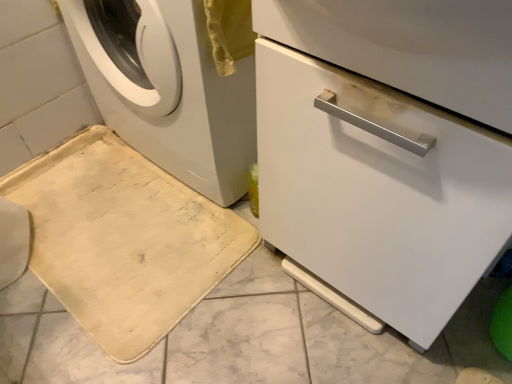
Question: From a real-world perspective, is white matte washing machine at left on beige fabric bath mat at lower left?

Choices:
 (A) yes
 (B) no

Answer: (A)

Question: Does white matte washing machine at left lie in front of beige fabric bath mat at lower left?

Choices:
 (A) yes
 (B) no

Answer: (A)

Question: Would you say white matte washing machine at left is outside beige fabric bath mat at lower left?

Choices:
 (A) yes
 (B) no

Answer: (A)

Question: Does white matte washing machine at left have a greater width compared to beige fabric bath mat at lower left?

Choices:
 (A) no
 (B) yes

Answer: (A)

Question: Is white matte washing machine at left not close to beige fabric bath mat at lower left?

Choices:
 (A) yes
 (B) no

Answer: (B)

Question: Relative to beige fabric bath mat at lower left, is white matte washing machine at left in front or behind?

Choices:
 (A) behind
 (B) front

Answer: (B)

Question: From their relative heights in the image, would you say white matte washing machine at left is taller or shorter than beige fabric bath mat at lower left?

Choices:
 (A) tall
 (B) short

Answer: (A)

Question: From the image's perspective, is white matte washing machine at left located above or below beige fabric bath mat at lower left?

Choices:
 (A) above
 (B) below

Answer: (A)

Question: Based on their sizes in the image, would you say white matte washing machine at left is bigger or smaller than beige fabric bath mat at lower left?

Choices:
 (A) big
 (B) small

Answer: (A)

Question: Is white matte washing machine at left in front of or behind white glossy dishwasher at center in the image?

Choices:
 (A) behind
 (B) front

Answer: (A)

Question: Would you say white matte washing machine at left is to the left or to the right of white glossy dishwasher at center in the picture?

Choices:
 (A) left
 (B) right

Answer: (A)

Question: Is point (183, 9) closer or farther from the camera than point (434, 97)?

Choices:
 (A) closer
 (B) farther

Answer: (B)

Question: Is white matte washing machine at left wider or thinner than white glossy dishwasher at center?

Choices:
 (A) thin
 (B) wide

Answer: (B)

Question: Is white glossy dishwasher at center wider or thinner than beige fabric bath mat at lower left?

Choices:
 (A) thin
 (B) wide

Answer: (A)

Question: Based on their positions, is white glossy dishwasher at center located to the left or right of beige fabric bath mat at lower left?

Choices:
 (A) right
 (B) left

Answer: (A)